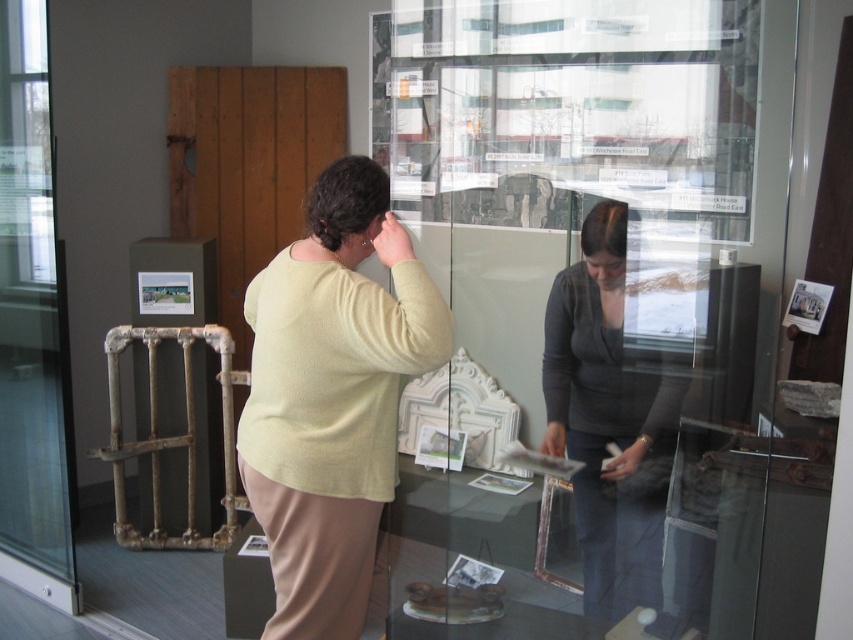
Question: Can you confirm if light yellow sweater at center is positioned to the right of dark gray sweater at center?

Choices:
 (A) yes
 (B) no

Answer: (B)

Question: Is light yellow sweater at center below dark gray sweater at center?

Choices:
 (A) yes
 (B) no

Answer: (B)

Question: Can you confirm if dark gray sweater at center is thinner than transparent glass door at left?

Choices:
 (A) no
 (B) yes

Answer: (A)

Question: Which object appears farthest from the camera in this image?

Choices:
 (A) transparent glass door at center
 (B) dark gray sweater at center
 (C) transparent glass door at left
 (D) light yellow sweater at center

Answer: (C)

Question: Which of the following is the closest to the observer?

Choices:
 (A) transparent glass door at left
 (B) transparent glass door at center

Answer: (B)

Question: Which of the following is the farthest from the observer?

Choices:
 (A) (596, 392)
 (B) (33, 99)

Answer: (B)